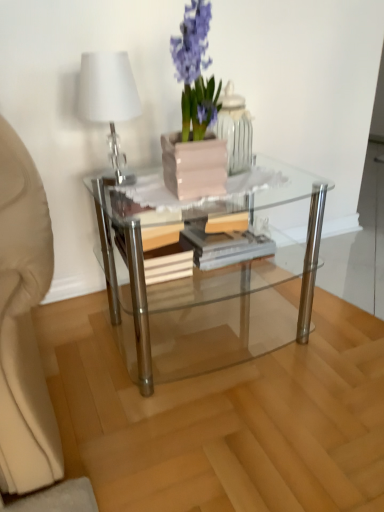
You are a GUI agent. You are given a task and a screenshot of the screen. Output one action in this format:
    pyautogui.click(x=<x>, y=<y>)
    Task: Click on the free space below transparent glass coffee table at center (from a real-world perspective)
    
    Given the screenshot: What is the action you would take?
    pyautogui.click(x=211, y=333)